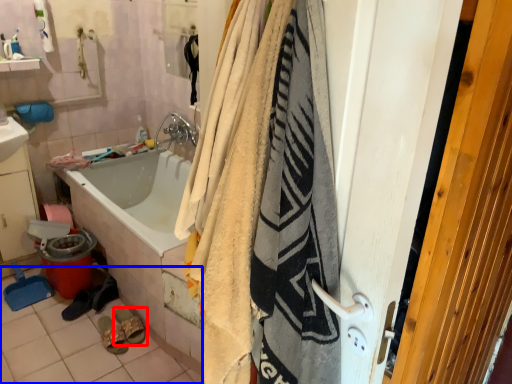
Question: Which of the following is the farthest to the observer, footwear (highlighted by a red box) or tile (highlighted by a blue box)?

Choices:
 (A) footwear
 (B) tile

Answer: (A)